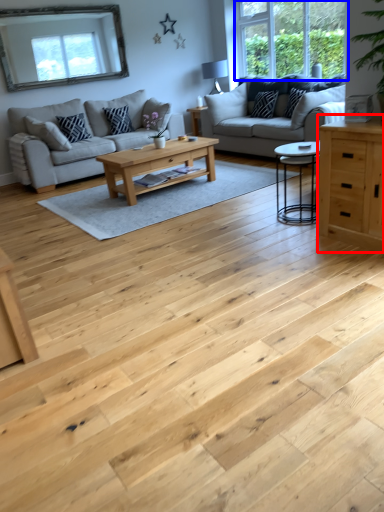
Question: Which point is closer to the camera, chest of drawers (highlighted by a red box) or window (highlighted by a blue box)?

Choices:
 (A) chest of drawers
 (B) window

Answer: (A)